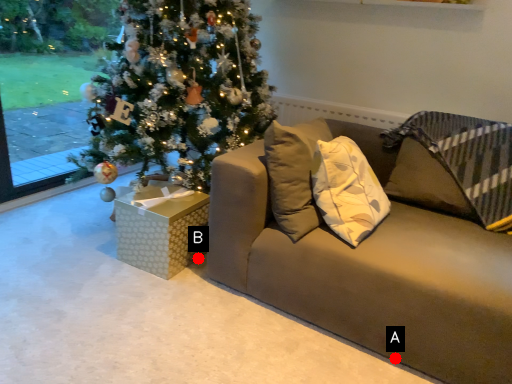
Question: Two points are circled on the image, labeled by A and B beside each circle. Which of the following is the closest to the observer?

Choices:
 (A) A is closer
 (B) B is closer

Answer: (A)